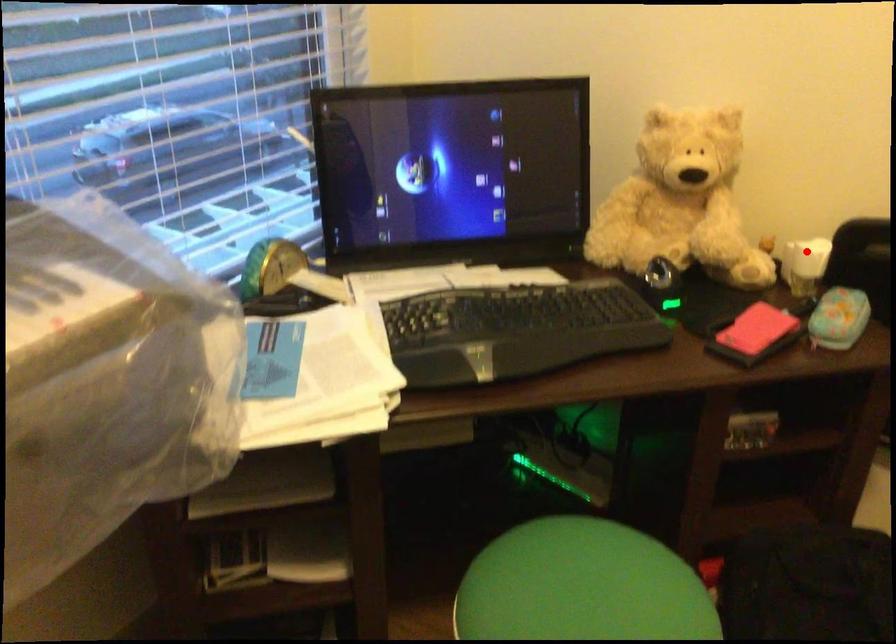
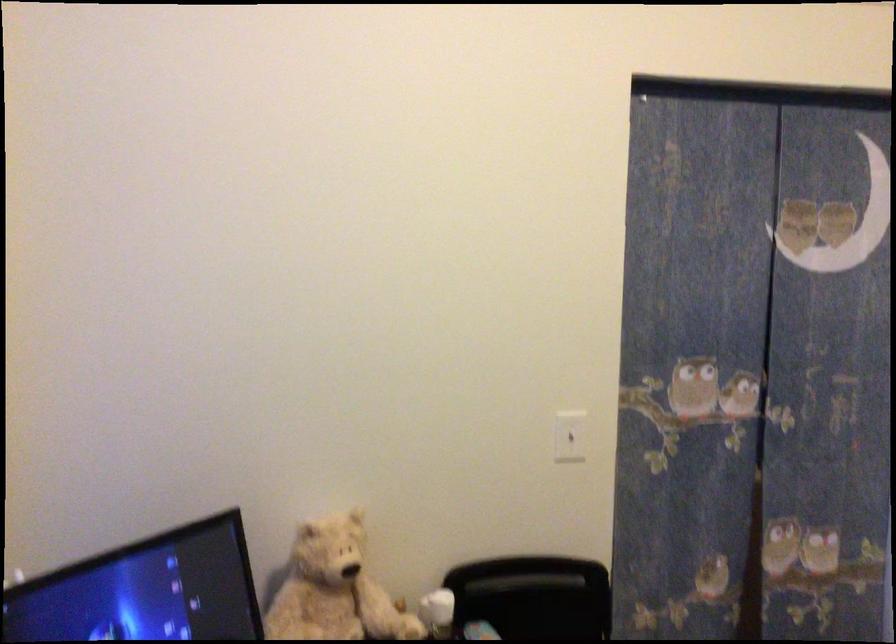
Question: I am providing you with two images of the same scene from different viewpoints. In image1, a red point is highlighted. Considering the same 3D point in image2, which of the following is correct?

Choices:
 (A) It is closer
 (B) It is farther

Answer: (B)